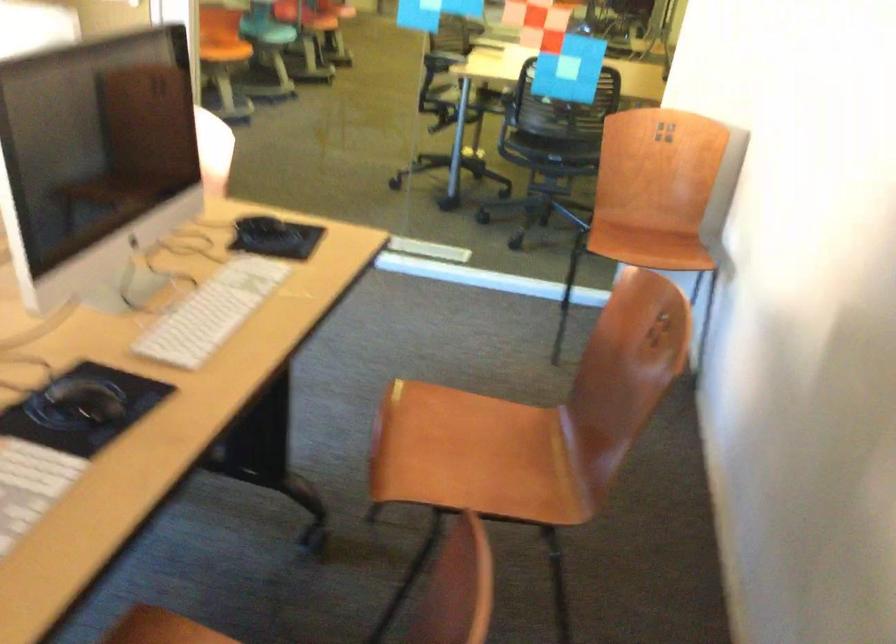
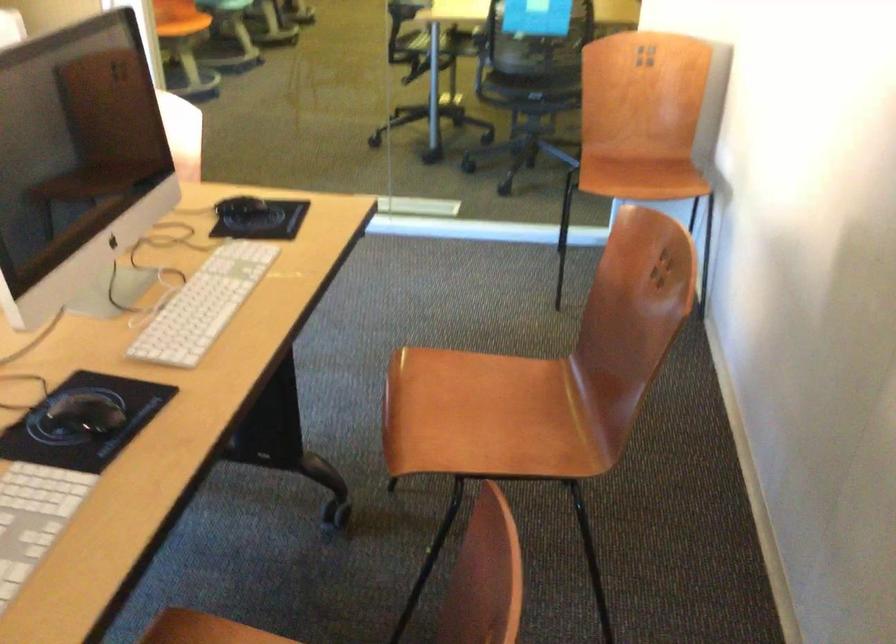
Question: The images are taken continuously from a first-person perspective. In which direction is your viewpoint rotating?

Choices:
 (A) Left
 (B) Right
 (C) Up
 (D) Down

Answer: (D)